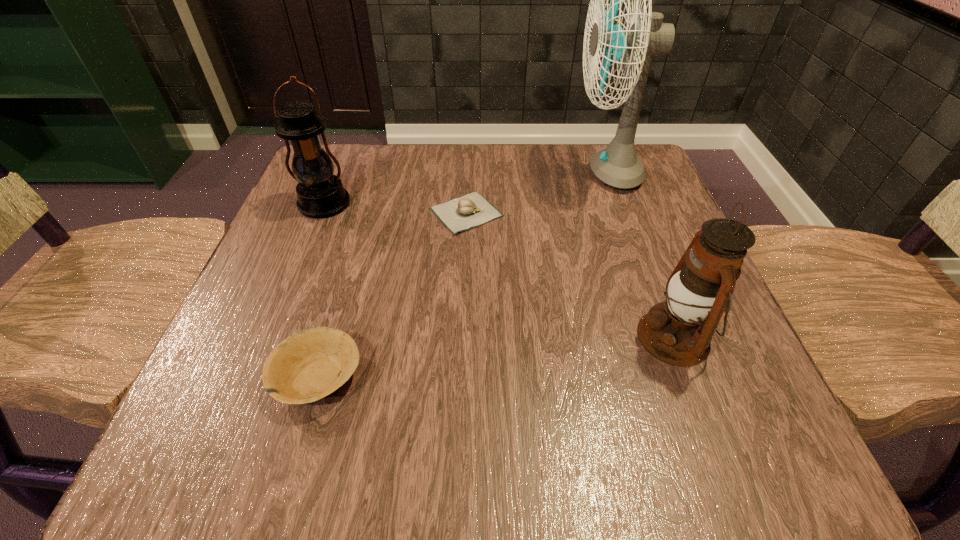
The height and width of the screenshot is (540, 960). Find the location of `free point between the tallest object and the fourth tallest object`. free point between the tallest object and the fourth tallest object is located at coordinates (462, 274).

Identify the location of free spot between the bowl and the tallest object. (462, 274).

The image size is (960, 540). Identify the location of free space between the left lantern and the bowl. (321, 291).

The image size is (960, 540). In order to click on free spot between the garlic and the bowl in this screenshot , I will do `click(392, 295)`.

The image size is (960, 540). I want to click on object that is the closest to the nearer lantern, so click(460, 214).

Point out which object is positioned as the fourth nearest to the fourth tallest object. Please provide its 2D coordinates. Your answer should be formatted as a tuple, i.e. [(x, y)], where the tuple contains the x and y coordinates of a point satisfying the conditions above.

[(617, 165)]

The width and height of the screenshot is (960, 540). Find the location of `free space that satisfies the following two spatial constraints: 1. above the farther lantern, indicating its light source; 2. on the left side of the shortest object`. free space that satisfies the following two spatial constraints: 1. above the farther lantern, indicating its light source; 2. on the left side of the shortest object is located at coordinates (x=321, y=212).

Locate an element on the screen. This screenshot has width=960, height=540. vacant space that satisfies the following two spatial constraints: 1. on the front-facing side of the fan; 2. above the left lantern, indicating its light source is located at coordinates (618, 205).

This screenshot has height=540, width=960. I want to click on free spot that satisfies the following two spatial constraints: 1. on the back side of the garlic; 2. on the left side of the second shortest object, so click(366, 212).

This screenshot has height=540, width=960. I want to click on free space in the image that satisfies the following two spatial constraints: 1. on the front-facing side of the fan; 2. above the farther lantern, indicating its light source, so click(x=618, y=205).